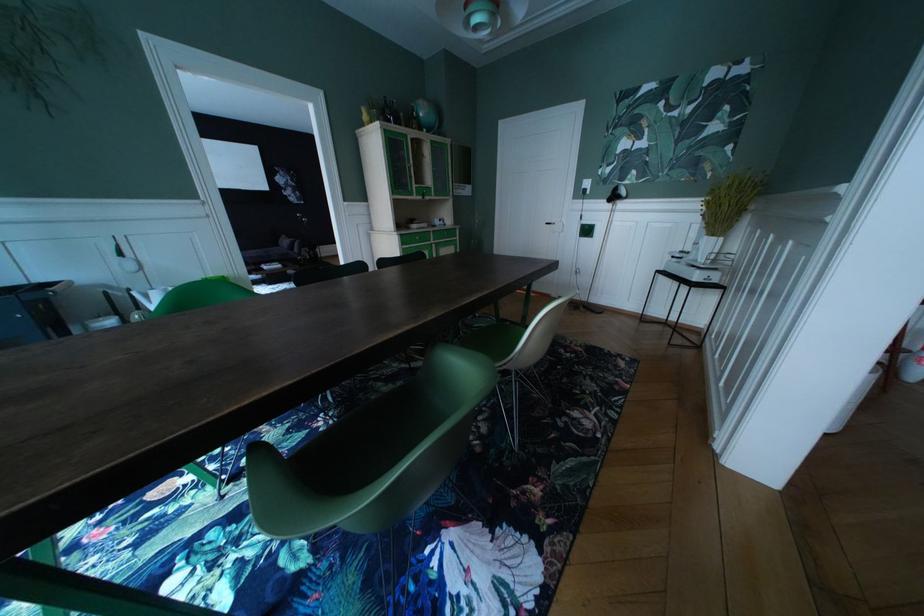
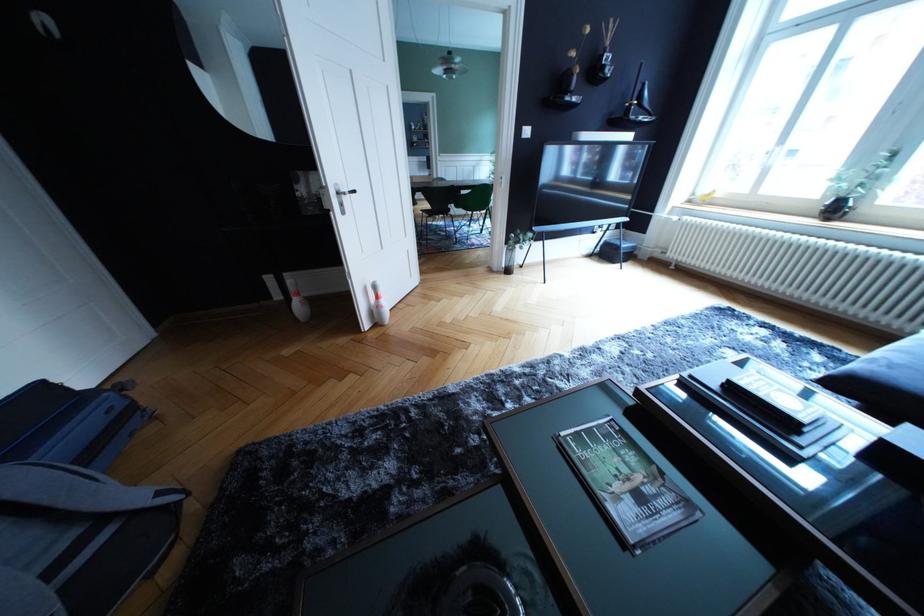
Question: I am providing you with two images of the same scene from different viewpoints. Please identify which objects are invisible in image2.

Choices:
 (A) glass vase
 (B) gray stool sitting surface
 (C) green chair sitting surface
 (D) sofa sitting surface

Answer: (C)